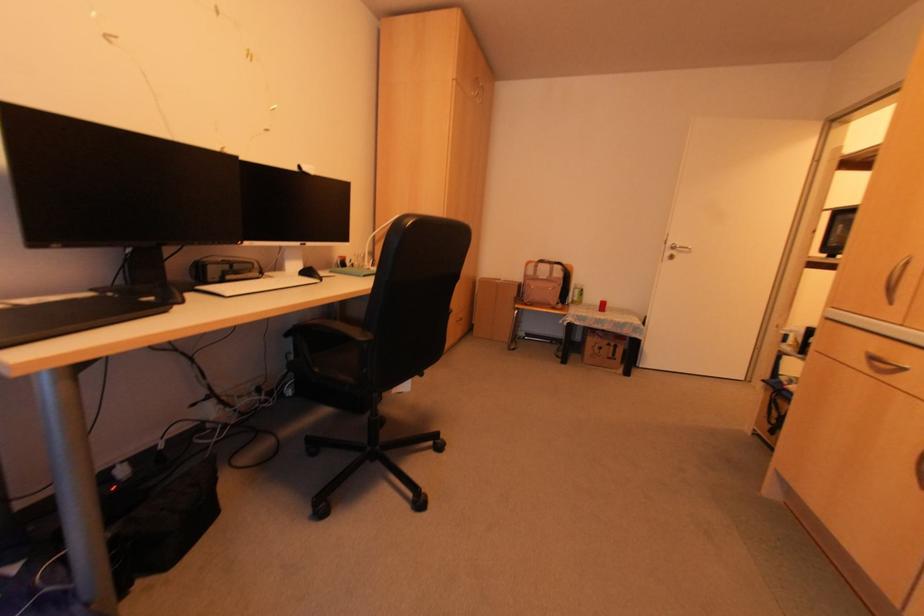
Find where to pull the silver door handle. Please return your answer as a coordinate pair (x, y).

(675, 249)